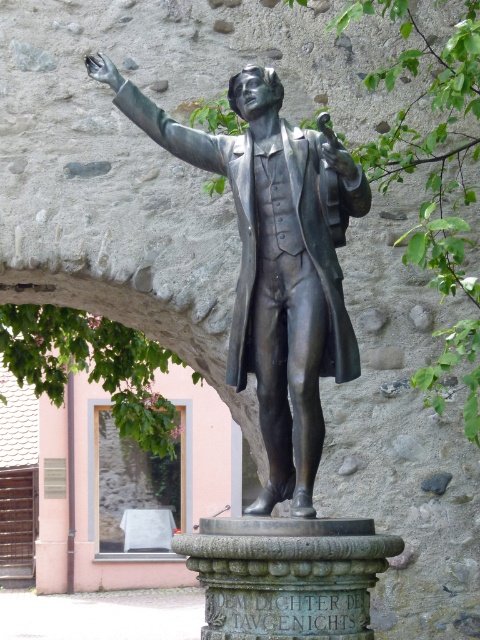
Question: Where is shiny bronze statue at center located in relation to green leafy tree at upper right in the image?

Choices:
 (A) above
 (B) below

Answer: (B)

Question: From the image, what is the correct spatial relationship of shiny bronze statue at center in relation to green leafy tree at upper right?

Choices:
 (A) below
 (B) above

Answer: (A)

Question: Which of the following is the farthest from the observer?

Choices:
 (A) (432, 131)
 (B) (305, 260)

Answer: (A)

Question: Is shiny bronze statue at center below green leafy tree at upper right?

Choices:
 (A) yes
 (B) no

Answer: (A)

Question: Which point appears closest to the camera in this image?

Choices:
 (A) (273, 358)
 (B) (420, 259)

Answer: (A)